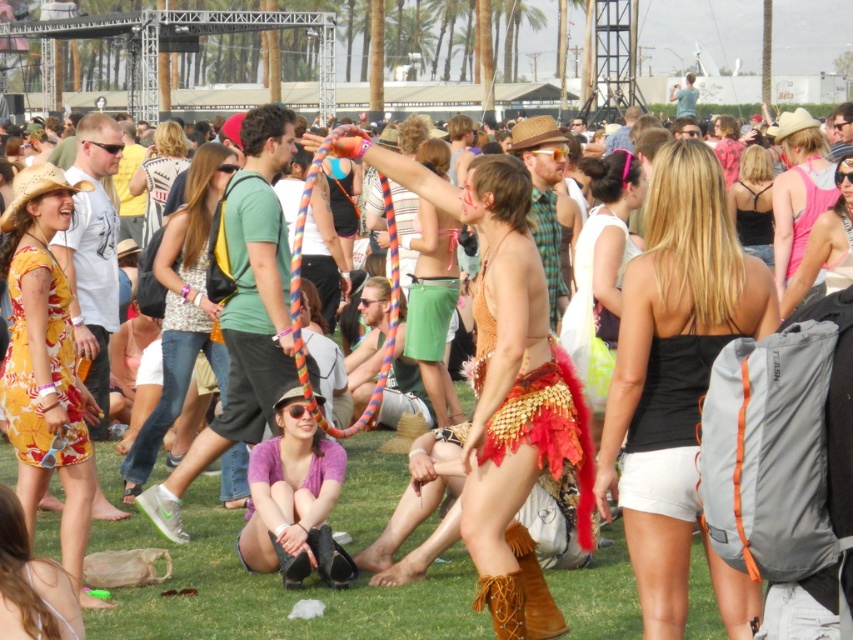
Which is below, yellow floral dress at center or denim jeans at center?

yellow floral dress at center is lower down.

Who is more distant from viewer, (16, 378) or (216, 170)?

The point (216, 170) is behind.

The width and height of the screenshot is (853, 640). I want to click on yellow floral dress at center, so click(x=45, y=364).

Can you confirm if yellow floral dress at center is shorter than black satin tank top at center?

Incorrect, yellow floral dress at center's height does not fall short of black satin tank top at center's.

Is yellow floral dress at center to the right of black satin tank top at center from the viewer's perspective?

Incorrect, yellow floral dress at center is not on the right side of black satin tank top at center.

Find the location of `yellow floral dress at center`. yellow floral dress at center is located at coordinates (45, 364).

The height and width of the screenshot is (640, 853). I want to click on yellow floral dress at center, so click(x=45, y=364).

Does matte pink bikini top at lower center have a lesser width compared to black satin tank top at center?

Yes.

Can you confirm if matte pink bikini top at lower center is smaller than black satin tank top at center?

Correct, matte pink bikini top at lower center occupies less space than black satin tank top at center.

Is point (19, 634) closer to camera compared to point (761, 218)?

Yes, it is.

The height and width of the screenshot is (640, 853). What are the coordinates of `matte pink bikini top at lower center` in the screenshot? It's located at click(32, 582).